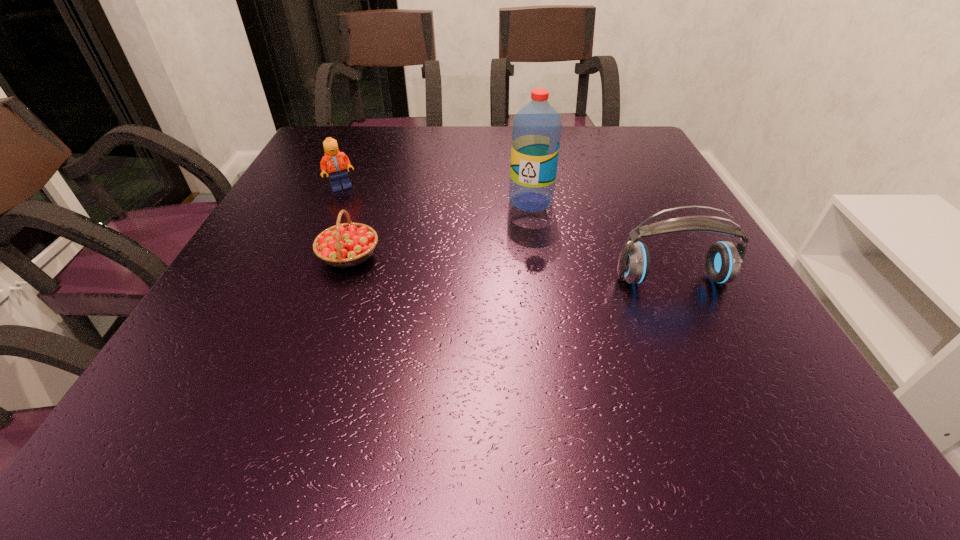
Locate an element on the screen. strawberry is located at coordinates (349, 244).

Locate an element on the screen. This screenshot has height=540, width=960. the rightmost object is located at coordinates (723, 261).

Locate an element on the screen. the second tallest object is located at coordinates (723, 261).

The width and height of the screenshot is (960, 540). I want to click on water bottle, so [x=536, y=133].

Where is `the tallest object`? The width and height of the screenshot is (960, 540). the tallest object is located at coordinates (536, 133).

Where is `the third tallest object`? the third tallest object is located at coordinates (336, 163).

You are a GUI agent. You are given a task and a screenshot of the screen. Output one action in this format:
    pyautogui.click(x=<x>, y=<y>)
    Task: Click on the free space located 0.200m on the front of the shortest object
    
    Given the screenshot: What is the action you would take?
    pyautogui.click(x=312, y=362)

Locate an element on the screen. This screenshot has height=540, width=960. vacant space located on the ear cups of the headset is located at coordinates (713, 364).

Identify the location of free region located on the front label of the third object from left to right. This screenshot has width=960, height=540. (512, 224).

The image size is (960, 540). In order to click on free location located on the front label of the third object from left to right in this screenshot , I will do `click(419, 327)`.